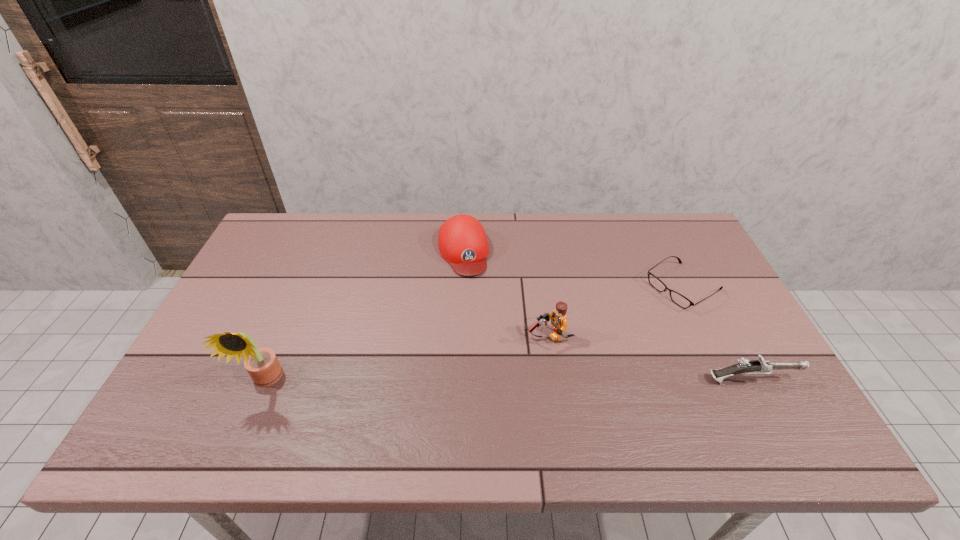
At what (x,y) coordinates should I click in order to perform the action: click on gun situated at the right edge. Please return your answer as a coordinate pair (x, y). This screenshot has width=960, height=540. Looking at the image, I should click on (760, 366).

The height and width of the screenshot is (540, 960). Identify the location of spectacles situated at the right edge. (677, 298).

Find the location of a particular element. This screenshot has height=540, width=960. object situated at the near left corner is located at coordinates (262, 364).

Locate an element on the screen. The image size is (960, 540). object that is at the near right corner is located at coordinates (760, 366).

You are a GUI agent. You are given a task and a screenshot of the screen. Output one action in this format:
    pyautogui.click(x=<x>, y=<y>)
    Task: Click on the vacant region at the far edge of the desktop
    The image size is (960, 540).
    Given the screenshot: What is the action you would take?
    pyautogui.click(x=599, y=229)

In the image, there is a desktop. Where is `vacant space at the left edge`? The height and width of the screenshot is (540, 960). vacant space at the left edge is located at coordinates (233, 330).

The image size is (960, 540). What are the coordinates of `vacant space at the right edge of the desktop` in the screenshot? It's located at (727, 334).

You are a GUI agent. You are given a task and a screenshot of the screen. Output one action in this format:
    pyautogui.click(x=<x>, y=<y>)
    Task: Click on the vacant space at the far left corner of the desktop
    The height and width of the screenshot is (540, 960).
    Given the screenshot: What is the action you would take?
    pyautogui.click(x=269, y=232)

Locate an element on the screen. blank space at the near left corner of the desktop is located at coordinates (225, 401).

In the image, there is a desktop. At what (x,y) coordinates should I click in order to perform the action: click on vacant space at the far right corner. Please return your answer as a coordinate pair (x, y). Looking at the image, I should click on (649, 221).